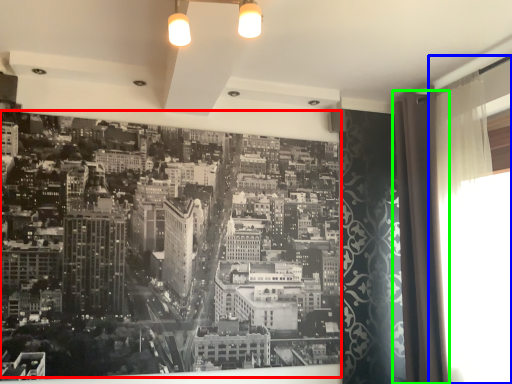
Question: Considering the real-world distances, which object is closest to hotel (highlighted by a red box)? window screen (highlighted by a blue box) or shower curtain (highlighted by a green box).

Choices:
 (A) window screen
 (B) shower curtain

Answer: (B)